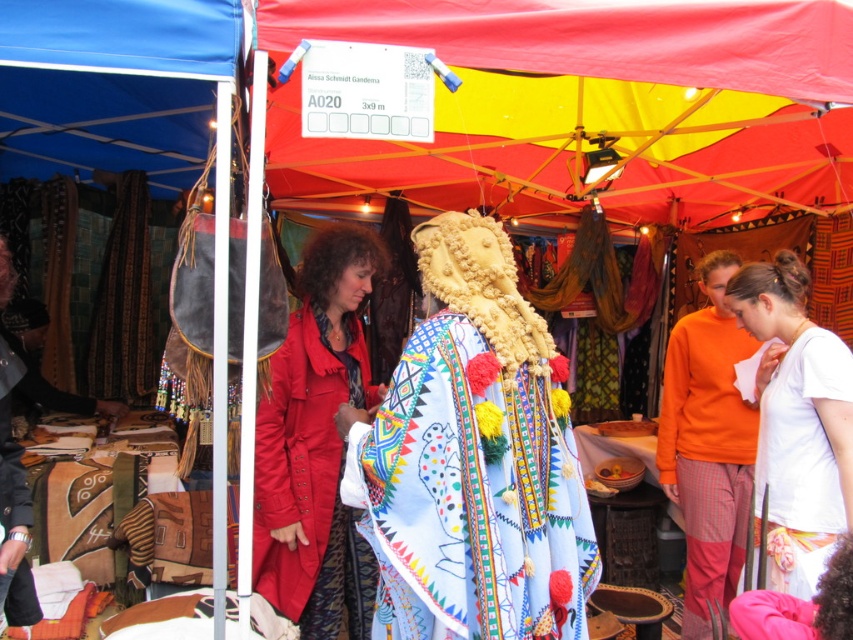
You are a customer at the market and want to know which clothing item is wider between the matte red coat at center and the matte black jacket at left. Can you determine this?

The matte red coat at center is wider than the matte black jacket at left according to the description.

You are a vendor at the market and need to hang a new display between the textured fabric cape at center and the matte red coat at center. Since the cape is wider, which item should you place closer to the edge to ensure both items are visible?

Since the textured fabric cape at center is wider than the matte red coat at center, you should place the matte red coat at center closer to the edge to ensure both items are visible.